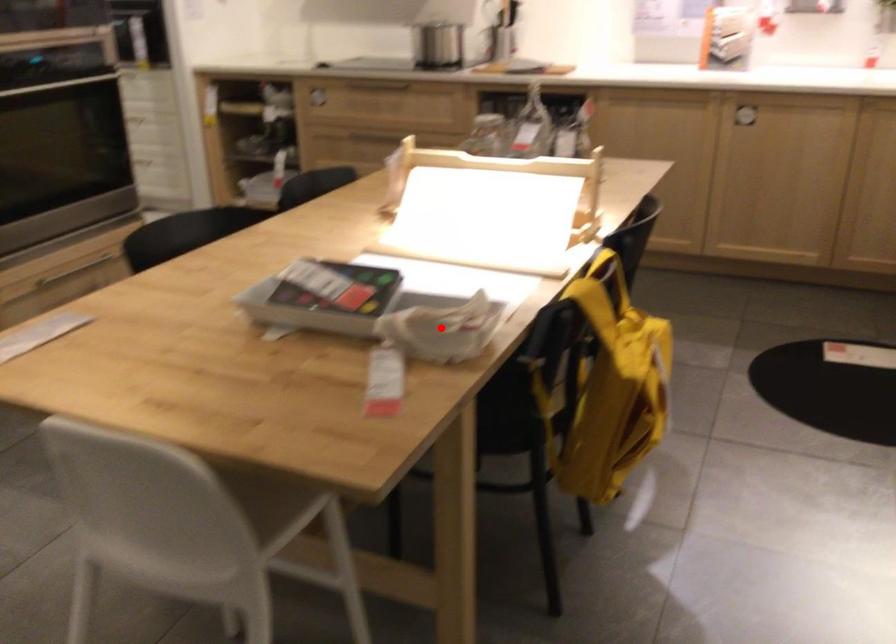
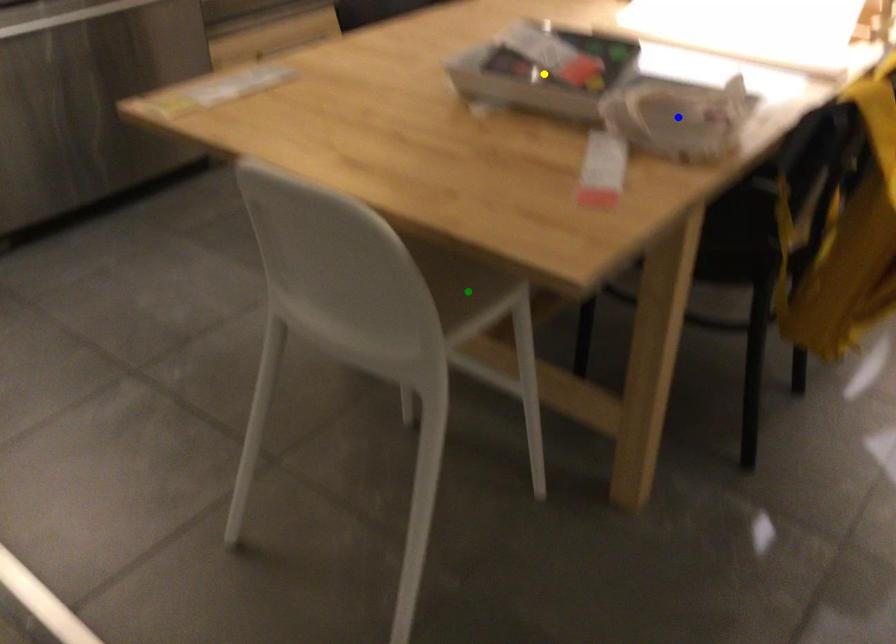
Question: I am providing you with two images of the same scene from different viewpoints. A red point is marked on the first image. You are given multiple points on the second image. Which mark in image 2 goes with the point in image 1?

Choices:
 (A) blue point
 (B) yellow point
 (C) green point

Answer: (A)